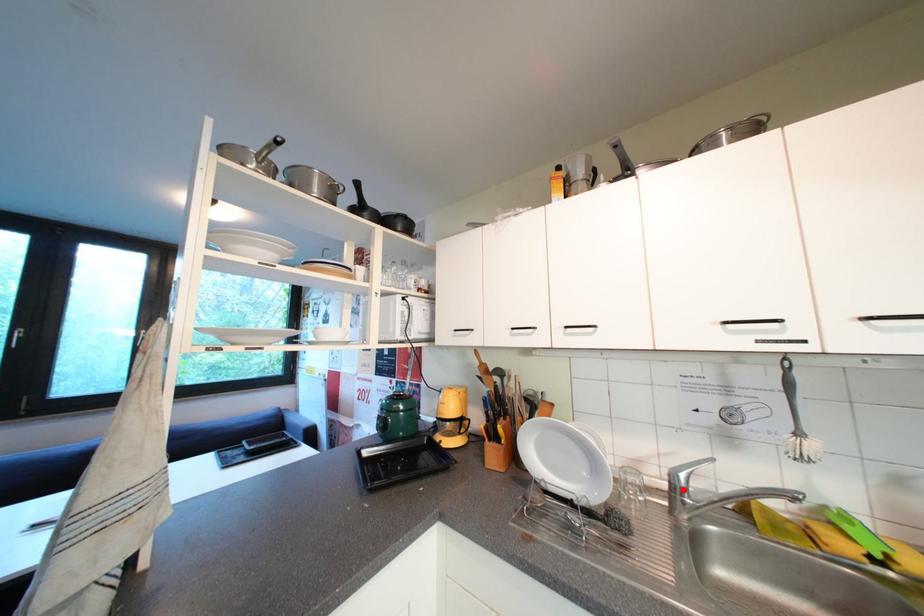
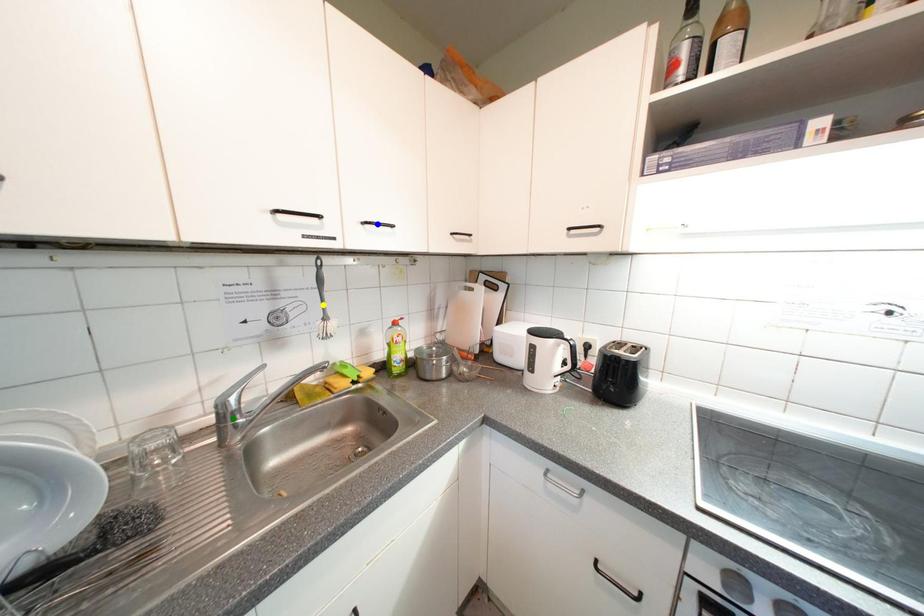
Question: I am providing you with two images of the same scene from different viewpoints. A red point is marked on the first image. You are given multiple points on the second image. Which mark in image 2 goes with the point in image 1?

Choices:
 (A) green point
 (B) blue point
 (C) yellow point

Answer: (A)